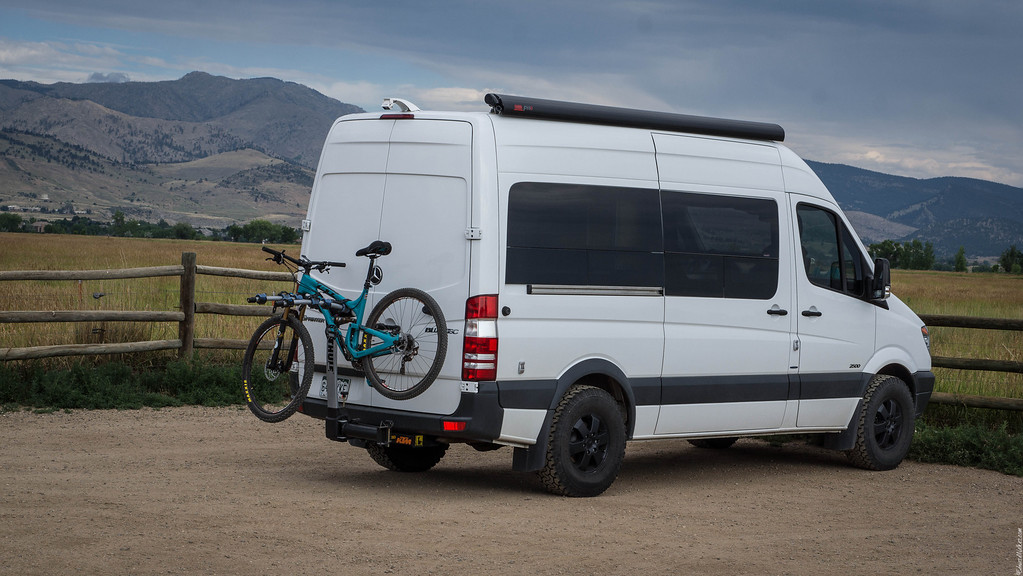
At what (x,y) coordinates should I click in order to perform the action: click on door handles. Please return your answer as a coordinate pair (x, y). The width and height of the screenshot is (1023, 576). Looking at the image, I should click on (811, 310), (772, 310).